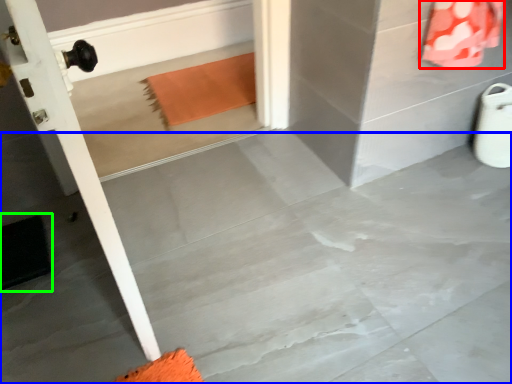
Question: Which object is the farthest from material (highlighted by a red box)? Choose among these: concrete (highlighted by a blue box) or doormat (highlighted by a green box).

Choices:
 (A) concrete
 (B) doormat

Answer: (B)